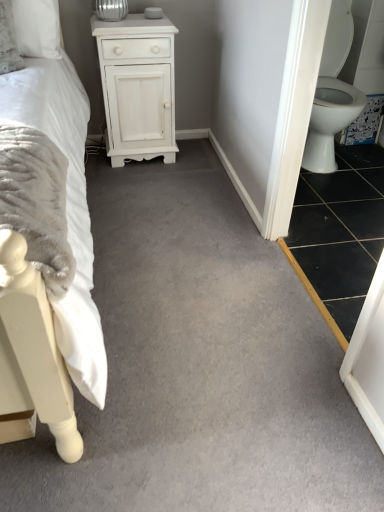
The width and height of the screenshot is (384, 512). Describe the element at coordinates (47, 242) in the screenshot. I see `white soft bed at left` at that location.

Identify the location of white matte cabinet at upper center. (138, 87).

Measure the distance between point (335, 109) and camera.

They are 2.22 meters apart.

Locate an element on the screen. white soft bed at left is located at coordinates [47, 242].

From the picture: From the image's perspective, would you say black tile at lower right is positioned over white soft bed at left?

No, from the image's perspective, black tile at lower right is not above white soft bed at left.

Is there a large distance between black tile at lower right and white soft bed at left?

Indeed, black tile at lower right is not near white soft bed at left.

Which object is thinner, white soft bed at left or white matte cabinet at upper center?

Thinner between the two is white matte cabinet at upper center.

Does white soft bed at left have a larger size compared to white matte cabinet at upper center?

Indeed, white soft bed at left has a larger size compared to white matte cabinet at upper center.

Considering the relative sizes of white soft bed at left and white matte cabinet at upper center in the image provided, is white soft bed at left shorter than white matte cabinet at upper center?

No, white soft bed at left is not shorter than white matte cabinet at upper center.

From the image's perspective, which is above, white soft bed at left or white matte cabinet at upper center?

white matte cabinet at upper center is shown above in the image.

Is point (169, 106) more distant than point (62, 52)?

Yes.

Is white matte cabinet at upper center turned away from white soft bed at left?

That's not correct — white matte cabinet at upper center is not looking away from white soft bed at left.

From a real-world perspective, between white matte cabinet at upper center and white soft bed at left, who is vertically higher?

From a 3D spatial view, white soft bed at left is above.

The width and height of the screenshot is (384, 512). Identify the location of chest of drawers above the white soft bed at left (from the image's perspective). (138, 87).

From the image's perspective, between black tile at lower right and white matte cabinet at upper center, which one is located above?

From the image's view, white matte cabinet at upper center is above.

Does point (365, 200) lie in front of point (141, 45)?

No, it is not.

Which is correct: black tile at lower right is inside white matte cabinet at upper center, or outside of it?

black tile at lower right exists outside the volume of white matte cabinet at upper center.

From a real-world perspective, is black tile at lower right above or below white matte cabinet at upper center?

In terms of real-world spatial position, black tile at lower right is below white matte cabinet at upper center.

Would you say white glossy toilet at right is a long distance from white matte cabinet at upper center?

No, there isn't a large distance between white glossy toilet at right and white matte cabinet at upper center.

Does white glossy toilet at right have a lesser width compared to white matte cabinet at upper center?

No, white glossy toilet at right is not thinner than white matte cabinet at upper center.

Would you say white glossy toilet at right is outside white matte cabinet at upper center?

white glossy toilet at right lies outside white matte cabinet at upper center's area.

Is white glossy toilet at right positioned with its back to black tile at lower right?

That's not correct — white glossy toilet at right is not looking away from black tile at lower right.

Which object is positioned more to the left, white glossy toilet at right or black tile at lower right?

white glossy toilet at right is more to the left.

From a real-world perspective, which is physically above, white glossy toilet at right or black tile at lower right?

white glossy toilet at right.

Is white glossy toilet at right directly adjacent to black tile at lower right?

white glossy toilet at right is not next to black tile at lower right, and they're not touching.

The height and width of the screenshot is (512, 384). What are the coordinates of `toilet on the right of white soft bed at left` in the screenshot? It's located at (332, 94).

Is white soft bed at left bigger than white glossy toilet at right?

Yes.

Between white soft bed at left and white glossy toilet at right, which one has less height?

white glossy toilet at right.

You are a GUI agent. You are given a task and a screenshot of the screen. Output one action in this format:
    pyautogui.click(x=<x>, y=<y>)
    Task: Click on the tile below the white soft bed at left (from the image's perspective)
    
    Given the screenshot: What is the action you would take?
    pyautogui.click(x=339, y=234)

Identify the location of bed that appears in front of the white matte cabinet at upper center. (47, 242).

From the picture: Estimate the real-world distances between objects in this image. Which object is closer to white matte cabinet at upper center, black tile at lower right or white soft bed at left?

white soft bed at left lies closer to white matte cabinet at upper center than the other object.

Estimate the real-world distances between objects in this image. Which object is further from white glossy toilet at right, white matte cabinet at upper center or black tile at lower right?

white matte cabinet at upper center lies further to white glossy toilet at right than the other object.

From the image, which object appears to be nearer to white soft bed at left, white glossy toilet at right or white matte cabinet at upper center?

white matte cabinet at upper center.

Based on their spatial positions, is white matte cabinet at upper center or white soft bed at left closer to white glossy toilet at right?

The object closer to white glossy toilet at right is white matte cabinet at upper center.

Looking at this image, based on their spatial positions, is white glossy toilet at right or white soft bed at left further from white matte cabinet at upper center?

Based on the image, white glossy toilet at right appears to be further to white matte cabinet at upper center.

Considering their positions, is black tile at lower right positioned further to white soft bed at left than white glossy toilet at right?

white glossy toilet at right is further to white soft bed at left.

Based on their spatial positions, is black tile at lower right or white soft bed at left closer to white glossy toilet at right?

Based on the image, black tile at lower right appears to be nearer to white glossy toilet at right.

Based on their spatial positions, is white soft bed at left or white matte cabinet at upper center closer to black tile at lower right?

Based on the image, white matte cabinet at upper center appears to be nearer to black tile at lower right.

This screenshot has height=512, width=384. What are the coordinates of `toilet located between white soft bed at left and black tile at lower right in the left-right direction` in the screenshot? It's located at (332, 94).

Identify the location of toilet between white soft bed at left and white matte cabinet at upper center along the z-axis. (332, 94).

Identify the location of tile between white soft bed at left and white matte cabinet at upper center along the z-axis. (339, 234).

At what (x,y) coordinates should I click in order to perform the action: click on toilet located between white matte cabinet at upper center and black tile at lower right in the left-right direction. Please return your answer as a coordinate pair (x, y). Looking at the image, I should click on (332, 94).